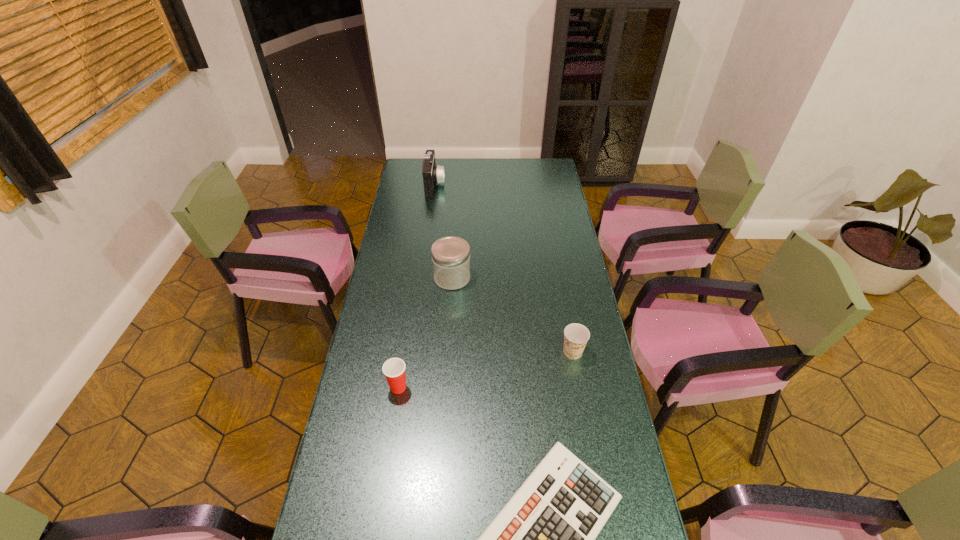
In order to click on object that is at the far edge in this screenshot , I will do (433, 174).

Find the location of a particular element. The image size is (960, 540). camcorder that is at the left edge is located at coordinates (433, 174).

You are a GUI agent. You are given a task and a screenshot of the screen. Output one action in this format:
    pyautogui.click(x=<x>, y=<y>)
    Task: Click on the Dixie cup at the left edge
    The height and width of the screenshot is (540, 960).
    Given the screenshot: What is the action you would take?
    pyautogui.click(x=394, y=369)

In order to click on object that is at the right edge in this screenshot , I will do `click(576, 335)`.

This screenshot has height=540, width=960. Find the location of `object that is at the far left corner`. object that is at the far left corner is located at coordinates (433, 174).

The image size is (960, 540). What are the coordinates of `free region at the far edge` in the screenshot? It's located at (489, 163).

You are a GUI agent. You are given a task and a screenshot of the screen. Output one action in this format:
    pyautogui.click(x=<x>, y=<y>)
    Task: Click on the blank space at the left edge of the desktop
    This screenshot has width=960, height=540.
    Given the screenshot: What is the action you would take?
    (397, 284)

Image resolution: width=960 pixels, height=540 pixels. I want to click on vacant area at the right edge of the desktop, so click(x=555, y=195).

The image size is (960, 540). Find the location of `vacant space that is in between the third farthest object and the camcorder`. vacant space that is in between the third farthest object and the camcorder is located at coordinates (504, 268).

Identify the location of vacant area between the farthest object and the right Dixie cup. (504, 268).